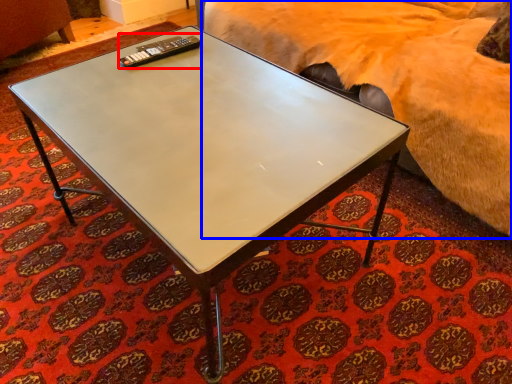
Question: Which of the following is the farthest to the observer, remote (highlighted by a red box) or bed (highlighted by a blue box)?

Choices:
 (A) remote
 (B) bed

Answer: (A)